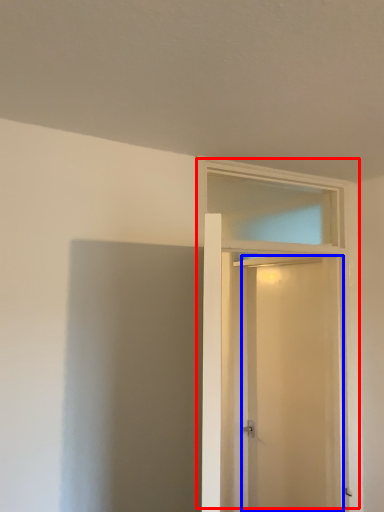
Question: Among these objects, which one is farthest to the camera, door (highlighted by a red box) or screen door (highlighted by a blue box)?

Choices:
 (A) door
 (B) screen door

Answer: (B)